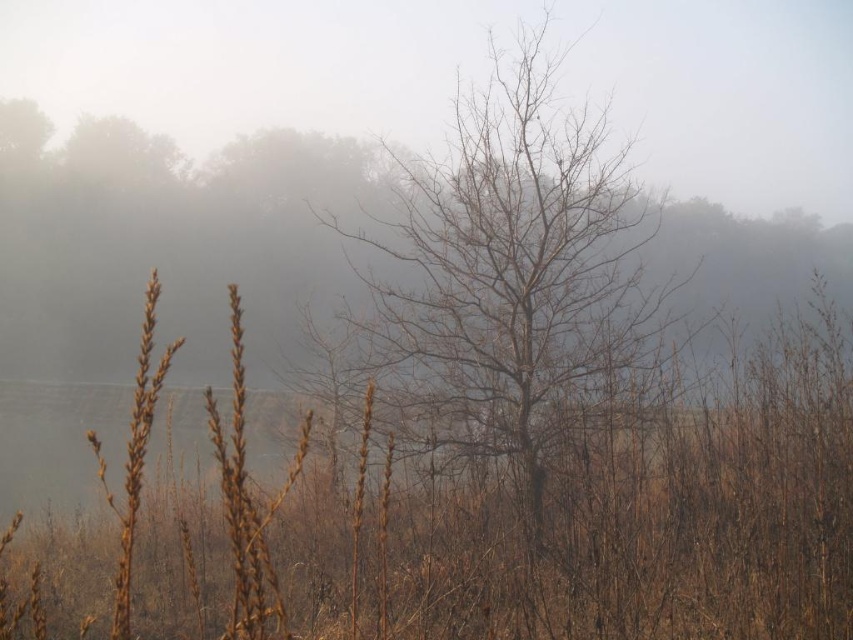
You are standing in the middle of a field and see a point marked at coordinates (555, 529). What is located at that point?

The point at coordinates (555, 529) indicates brown dry grass at center.

You are a photographer trying to capture the brown dry grass at center and the bare branches at center in a single shot. Which object will appear larger in your photo?

The brown dry grass at center will appear larger in the photo because it is closer to the viewer than the bare branches at center.

You are a photographer adjusting your camera settings to focus on two points in the landscape scene described. The first point is at coordinates point (737,532), and the second is at point (479,353). Which point should you focus on first if you want to ensure the closest object is sharp?

You should focus on point (737,532) first because it is closer to the camera than point (479,353) according to the description.